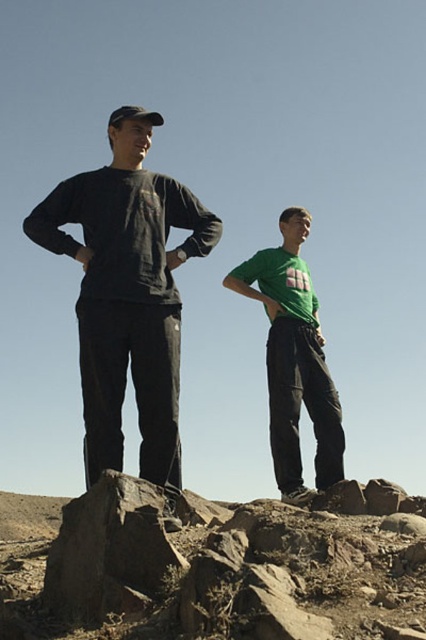
Does rusty rock at center have a greater width compared to matte black sweatshirt at center?

No.

How distant is rusty rock at center from matte black sweatshirt at center?

rusty rock at center and matte black sweatshirt at center are 2.55 meters apart.

This screenshot has height=640, width=426. Identify the location of rusty rock at center. (210, 570).

Based on the photo, is matte black sweatshirt at center wider than green matte shirt at center?

Incorrect, matte black sweatshirt at center's width does not surpass green matte shirt at center's.

Is point (97, 253) behind point (299, 241)?

No, it is not.

Between point (78, 180) and point (267, 307), which one is positioned in front?

Point (78, 180) is in front.

Image resolution: width=426 pixels, height=640 pixels. In order to click on matte black sweatshirt at center in this screenshot , I will do `click(127, 292)`.

Is rusty rock at center taller than green matte shirt at center?

No, rusty rock at center is not taller than green matte shirt at center.

Which is in front, point (161, 624) or point (275, 456)?

Point (161, 624)

At what (x,y) coordinates should I click in order to perform the action: click on rusty rock at center. Please return your answer as a coordinate pair (x, y). The image size is (426, 640). Looking at the image, I should click on (210, 570).

Locate an element on the screen. This screenshot has width=426, height=640. rusty rock at center is located at coordinates (210, 570).